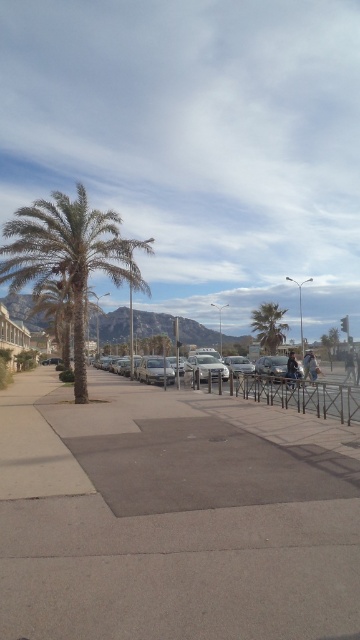
Measure the distance between gray concrete pavement at center and camera.

gray concrete pavement at center and camera are 3.32 meters apart.

Which is behind, point (131, 540) or point (191, 356)?

The point (191, 356) is behind.

The height and width of the screenshot is (640, 360). Identify the location of gray concrete pavement at center. (173, 516).

Is green leafy palm at left closer to the viewer compared to green leafy palm tree at center?

Yes, green leafy palm at left is closer to the viewer.

Does point (20, 236) come behind point (276, 316)?

No, (20, 236) is closer to viewer.

Does point (127, 266) come in front of point (275, 310)?

That is True.

At what (x,y) coordinates should I click in order to perform the action: click on green leafy palm at left. Please return your answer as a coordinate pair (x, y). This screenshot has height=640, width=360. Looking at the image, I should click on (69, 257).

Can you confirm if green leafy palm tree at left is positioned below green leafy palm tree at center?

Indeed, green leafy palm tree at left is positioned under green leafy palm tree at center.

Is point (57, 314) positioned behind point (281, 330)?

No, it is not.

Which is behind, point (83, 304) or point (267, 349)?

Positioned behind is point (267, 349).

Locate an element on the screen. Image resolution: width=360 pixels, height=640 pixels. green leafy palm tree at left is located at coordinates click(56, 310).